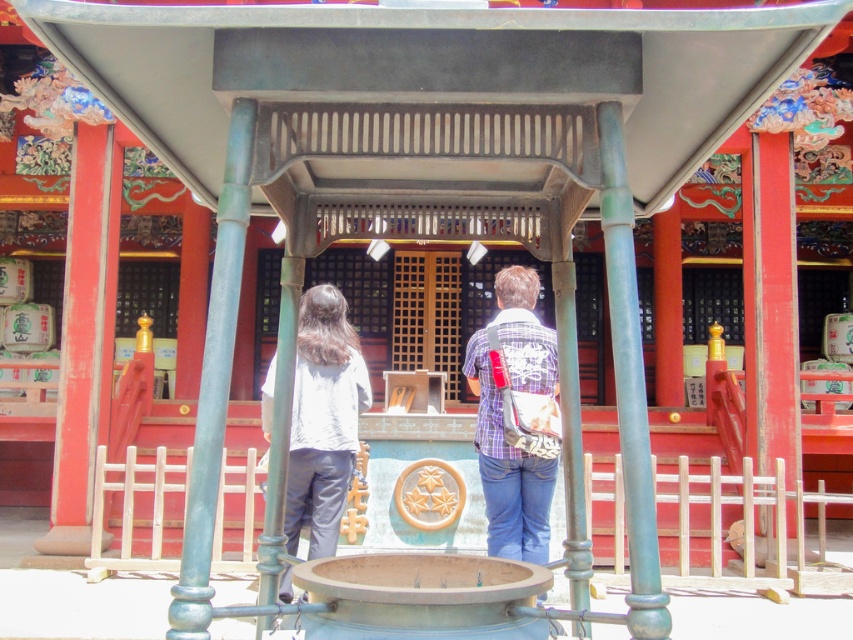
You are standing at the entrance of the shrine and see the point marked at coordinates (x=502, y=420). What object is located at that point?

The point at coordinates (x=502, y=420) marks the plaid fabric shirt at center.

Please use the coordinates provided to determine the position of the light gray fabric shirt at center in the image. What is its exact 2D coordinate?

The light gray fabric shirt at center is located at the 2D coordinate point of (323, 419).